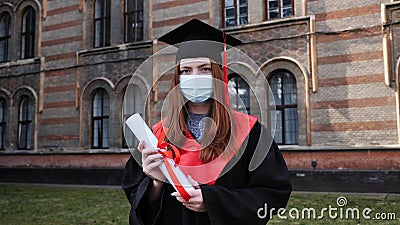
What are the coordinates of `degree scroll` in the screenshot? It's located at (137, 129).